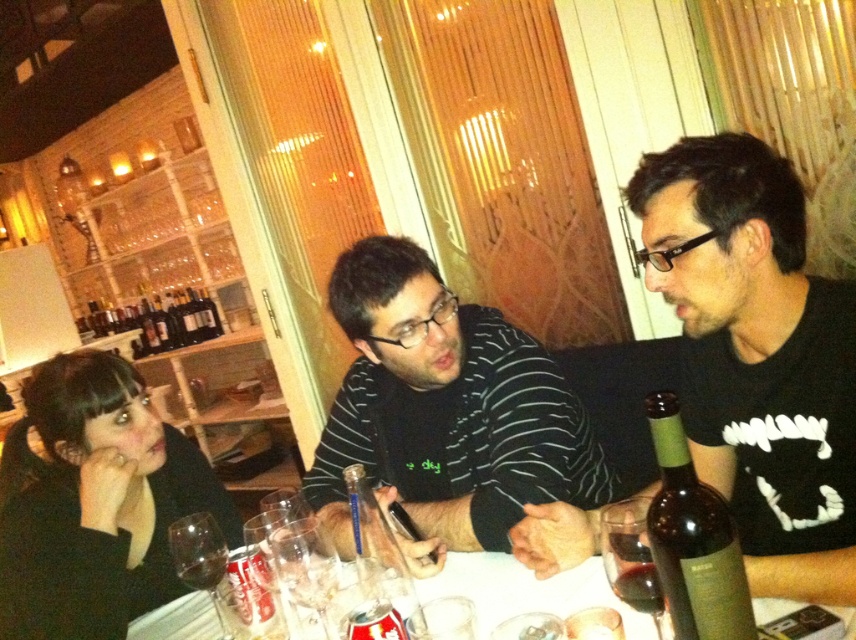
Question: Is clear plastic cups at center below clear glass bottle at center?

Choices:
 (A) no
 (B) yes

Answer: (B)

Question: Among these objects, which one is nearest to the camera?

Choices:
 (A) clear glass bottle at center
 (B) green matte bottle at table right

Answer: (B)

Question: Which of these objects is positioned farthest from the green matte bottle at table right?

Choices:
 (A) black matte shirt at center
 (B) black matte hair at upper left
 (C) transparent glass wine glass at lower left

Answer: (B)

Question: Is transparent glass at table center behind translucent glass wine glass at table center?

Choices:
 (A) yes
 (B) no

Answer: (A)

Question: Which of the following is the farthest from the observer?

Choices:
 (A) transparent glass wine glass at lower left
 (B) black matte hair at upper left
 (C) dark brown glass bottle at center

Answer: (C)

Question: Where is clear plastic cups at center located in relation to dark red glass at table center in the image?

Choices:
 (A) above
 (B) below

Answer: (B)